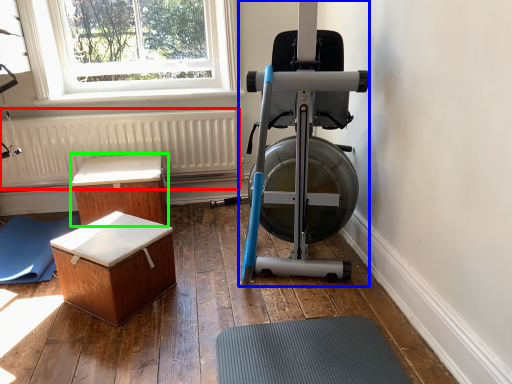
Question: Considering the real-world distances, which object is farthest from radiator (highlighted by a red box)? stationary bicycle (highlighted by a blue box) or furniture (highlighted by a green box)?

Choices:
 (A) stationary bicycle
 (B) furniture

Answer: (A)